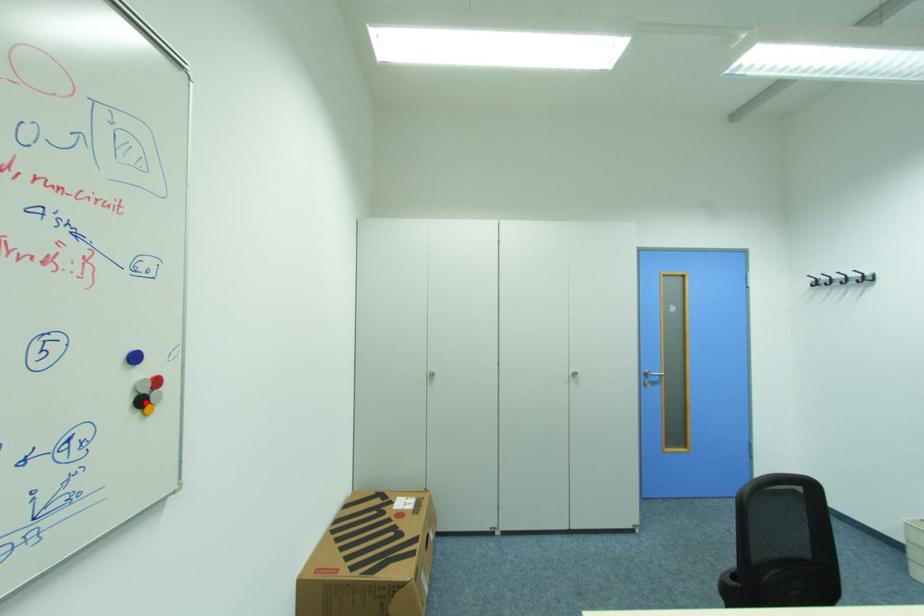
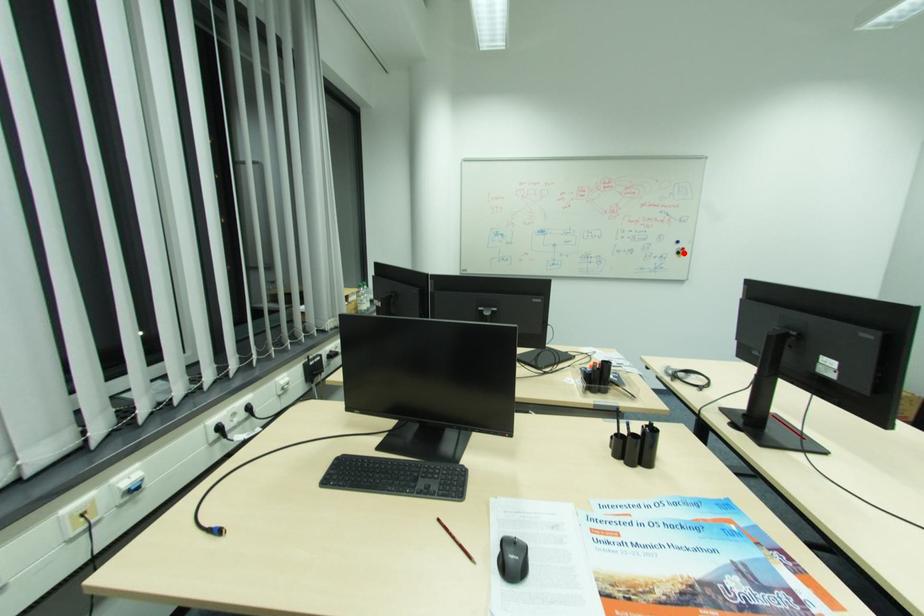
I am providing you with two images of the same scene from different viewpoints. A red point is marked on the first image and another point is marked on the second image. Is the red point in image1 aligned with the point shown in image2?

Yes